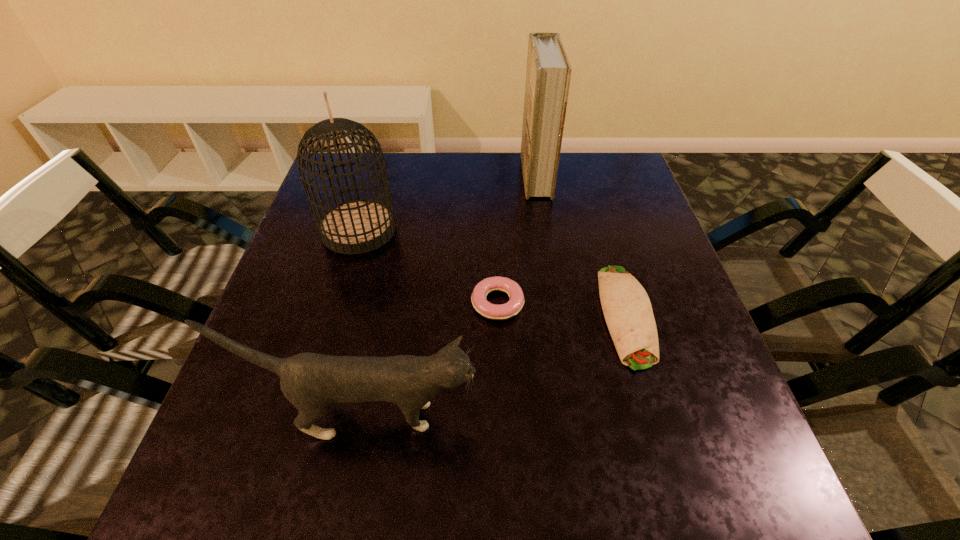
Where is `phonebook`? phonebook is located at coordinates (548, 75).

At what (x,y) coordinates should I click in order to perform the action: click on the farthest object. Please return your answer as a coordinate pair (x, y). The width and height of the screenshot is (960, 540). Looking at the image, I should click on (548, 75).

Locate an element on the screen. the second farthest object is located at coordinates (358, 226).

I want to click on the third shortest object, so click(x=311, y=382).

Locate an element on the screen. cat is located at coordinates (311, 382).

You are a GUI agent. You are given a task and a screenshot of the screen. Output one action in this format:
    pyautogui.click(x=<x>, y=<y>)
    Task: Click on the burrito
    Image resolution: width=960 pixels, height=540 pixels.
    Given the screenshot: What is the action you would take?
    pyautogui.click(x=627, y=309)

Where is `the shortest object`? Image resolution: width=960 pixels, height=540 pixels. the shortest object is located at coordinates (486, 309).

Image resolution: width=960 pixels, height=540 pixels. Find the location of `free space located 0.200m on the cover of the fourth object from left to right`. free space located 0.200m on the cover of the fourth object from left to right is located at coordinates (453, 177).

Locate an element on the screen. Image resolution: width=960 pixels, height=540 pixels. vacant space situated 0.220m on the cover of the fourth object from left to right is located at coordinates (446, 177).

Locate an element on the screen. This screenshot has width=960, height=540. free space located 0.210m on the cover of the fourth object from left to right is located at coordinates (450, 177).